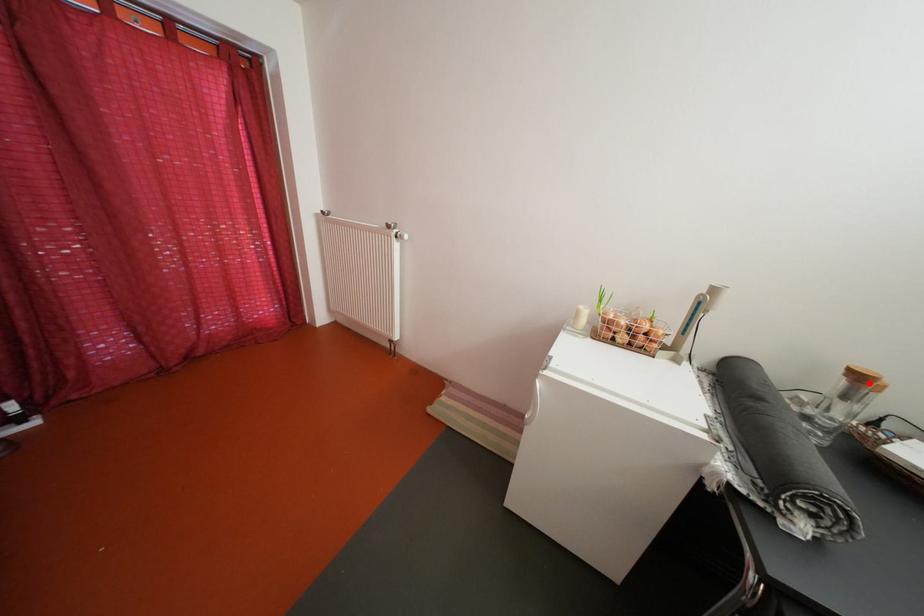
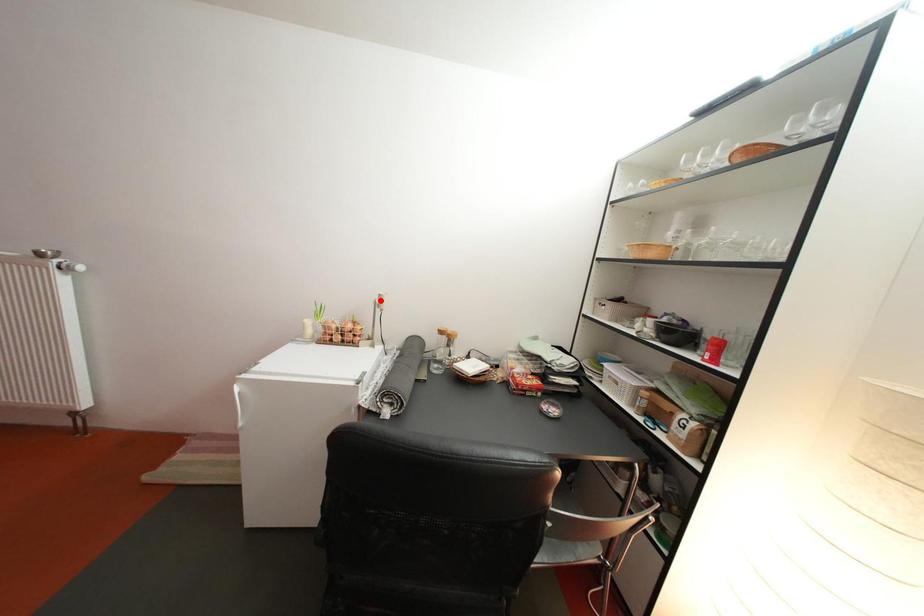
I am providing you with two images of the same scene from different viewpoints. A red point is marked on the first image and another point is marked on the second image. Does the point marked in image1 correspond to the same location as the one in image2?

No